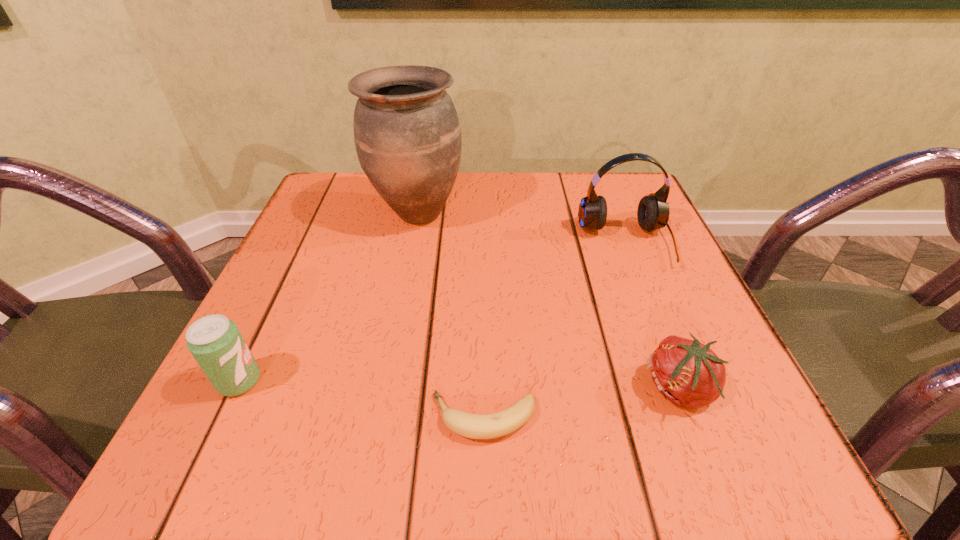
This screenshot has height=540, width=960. Find the location of `blank space located at the stem of the banana`. blank space located at the stem of the banana is located at coordinates (219, 417).

Locate an element on the screen. The image size is (960, 540). vacant space located 0.110m at the stem of the banana is located at coordinates (348, 417).

Locate an element on the screen. vacant region located at the stem of the banana is located at coordinates coord(219,417).

Where is `urn that is at the far edge`? This screenshot has height=540, width=960. urn that is at the far edge is located at coordinates [x=407, y=135].

The height and width of the screenshot is (540, 960). Identify the location of headset that is at the far edge. (653, 211).

This screenshot has height=540, width=960. I want to click on tomato present at the near edge, so click(688, 373).

Find the location of a particular element. This screenshot has width=960, height=540. banana that is at the near edge is located at coordinates (474, 426).

Locate an element on the screen. The width and height of the screenshot is (960, 540). urn that is at the left edge is located at coordinates (407, 135).

I want to click on soda present at the left edge, so click(215, 342).

I want to click on headset at the right edge, so coord(653,211).